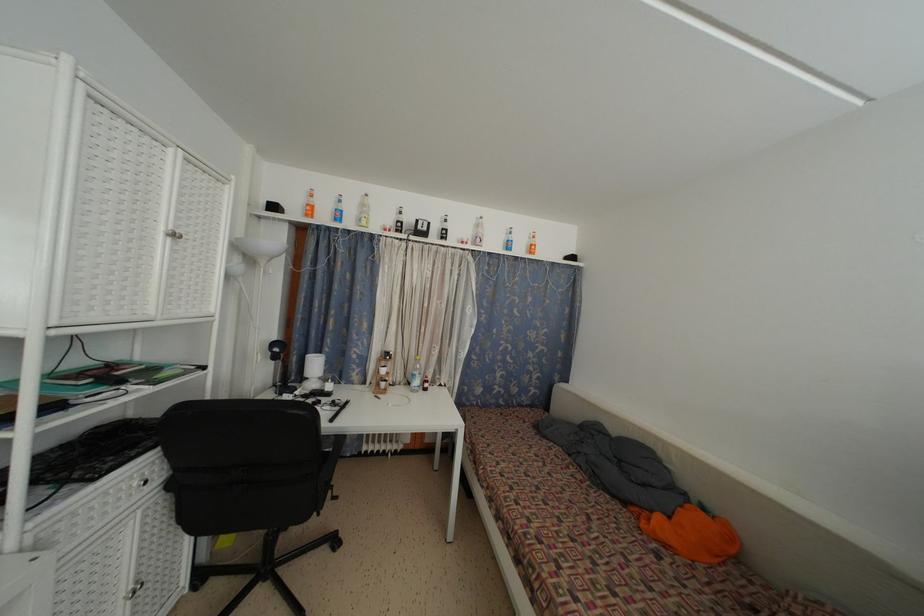
Where would you resting arm the black chair armrest? Please return your answer as a coordinate pair (x, y).

(329, 469)